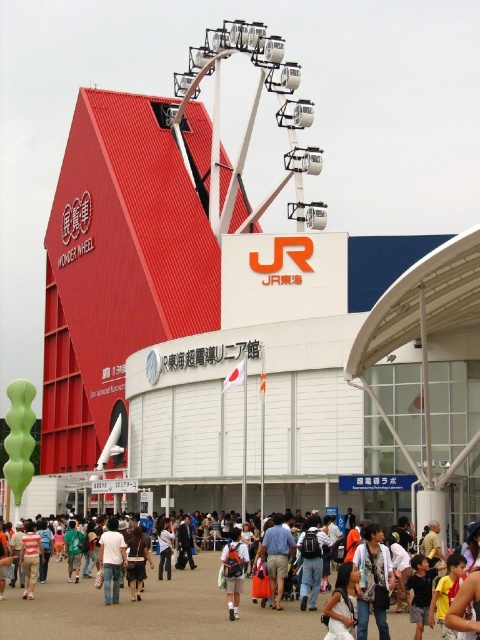
Between blue denim shorts at center and white school uniform at center, which one appears on the left side from the viewer's perspective?

Positioned to the left is white school uniform at center.

Consider the image. Can you confirm if blue denim shorts at center is smaller than white school uniform at center?

Indeed, blue denim shorts at center has a smaller size compared to white school uniform at center.

Which is in front, point (265, 550) or point (231, 557)?

Point (231, 557)

Identify the location of blue denim shorts at center. (276, 556).

How much distance is there between white cotton shirt at center and light brown backpack at center?

The distance of white cotton shirt at center from light brown backpack at center is 13.78 meters.

Is white cotton shirt at center in front of light brown backpack at center?

No, it is behind light brown backpack at center.

The height and width of the screenshot is (640, 480). What are the coordinates of `white cotton shirt at center` in the screenshot? It's located at (152, 611).

You are a GUI agent. You are given a task and a screenshot of the screen. Output one action in this format:
    pyautogui.click(x=<x>, y=<y>)
    Task: Click on the white cotton shirt at center
    
    Given the screenshot: What is the action you would take?
    pyautogui.click(x=152, y=611)

Does point (379, 577) come in front of point (111, 531)?

Yes, it is in front of point (111, 531).

Does light brown backpack at center appear under white matte shirt at center?

No.

Is point (380, 611) less distant than point (117, 589)?

Yes, it is.

Where is `light brown backpack at center`? This screenshot has width=480, height=640. light brown backpack at center is located at coordinates (372, 580).